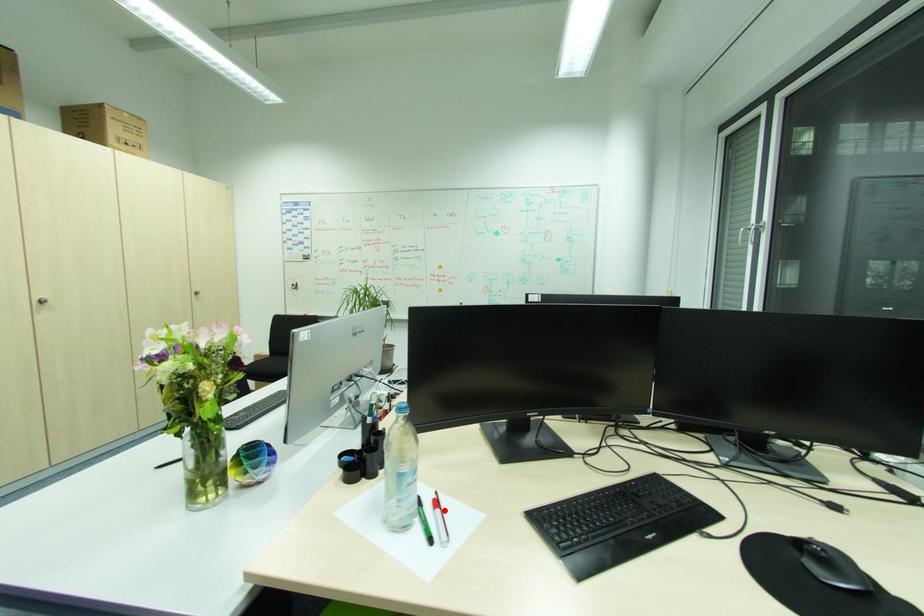
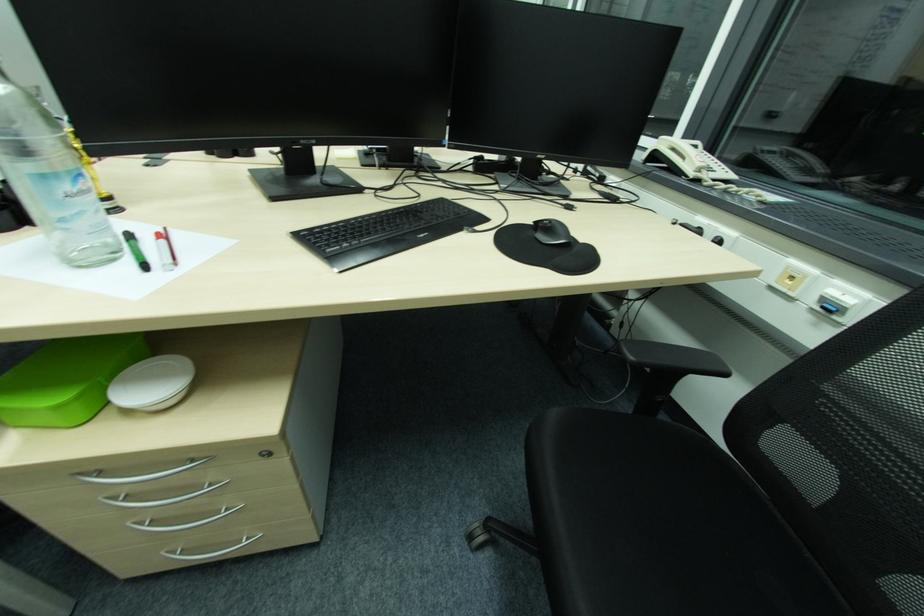
Locate, in the second image, the point that corresponds to the highlighted location in the first image.

(167, 241)